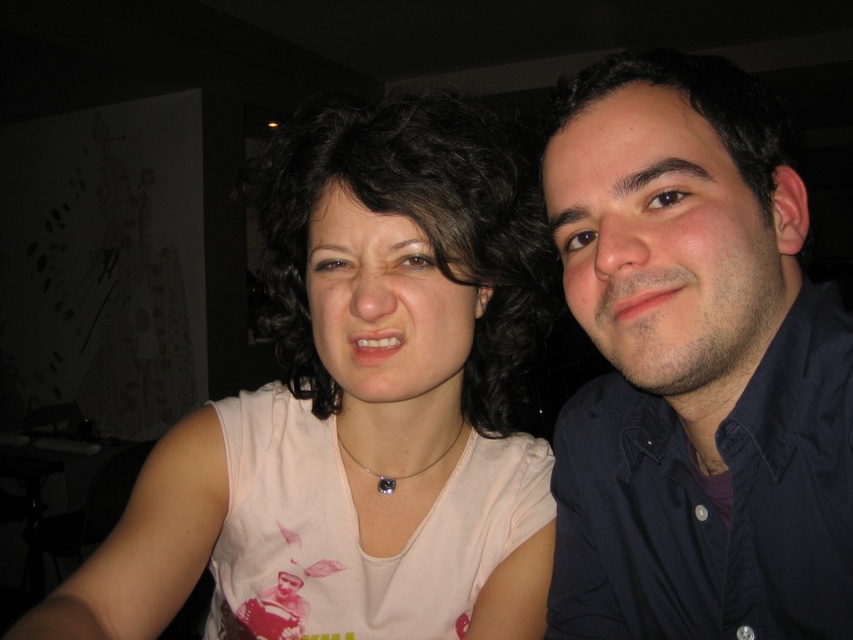
You are a photographer trying to capture a candid shot of the two people in the image. Since the pink fabric shirt at center and the dark blue shirt at right are overlapping, which shirt should you focus on to ensure the entire face of the person wearing it is visible?

The dark blue shirt at right should be focused on because the pink fabric shirt at center is positioned over it, so focusing on the dark blue shirt at right would allow the entire face of its wearer to be visible without obstruction.

You are at a social event and see two people sitting together. The person on the left is wearing a light pink sleeveless top with a graphic design and a necklace, while the person on the right is in a dark blue buttoned shirt. There is a specific point at coordinates (357, 410). What object is located exactly at that point?

The pink fabric shirt at center is located exactly at point (357, 410).

You are trying to decide which shirt to wear for a casual event. You see the pink fabric shirt at center and the dark blue shirt at right in the image. Based on their positions in the image, which shirt is positioned more to the left?

The pink fabric shirt at center is positioned to the left of the dark blue shirt at right, so the pink fabric shirt at center is more to the left.